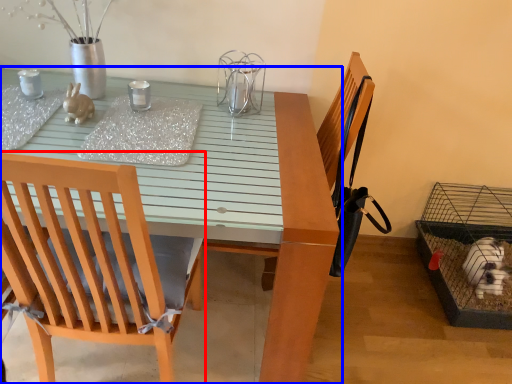
Question: Among these objects, which one is farthest to the camera, chair (highlighted by a red box) or table (highlighted by a blue box)?

Choices:
 (A) chair
 (B) table

Answer: (B)